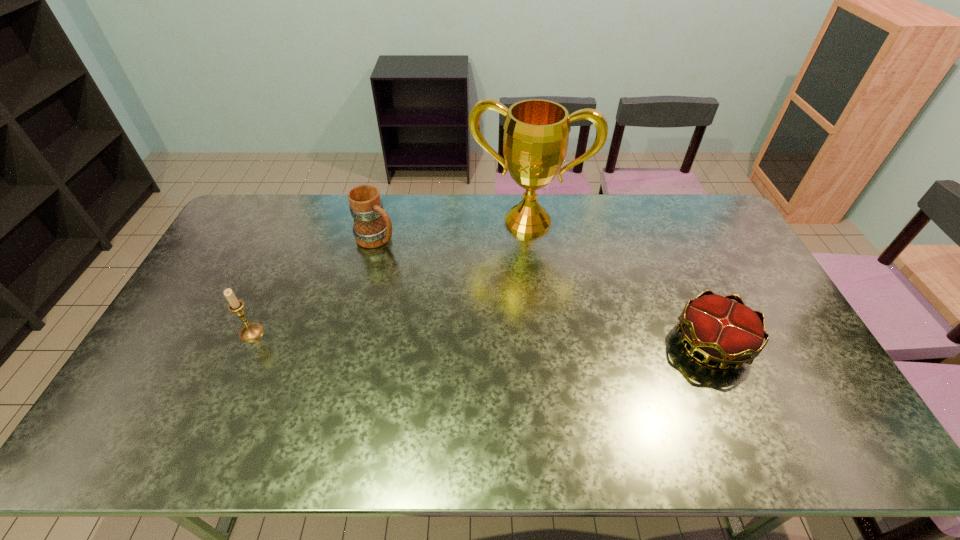
Locate an element on the screen. The image size is (960, 540). free spot located on the side of the mug with the handle is located at coordinates (439, 275).

You are a GUI agent. You are given a task and a screenshot of the screen. Output one action in this format:
    pyautogui.click(x=<x>, y=<y>)
    Task: Click on the vacant space situated 0.150m on the front-facing side of the third object from left to right
    The image size is (960, 540).
    Given the screenshot: What is the action you would take?
    pyautogui.click(x=510, y=269)

This screenshot has width=960, height=540. I want to click on free space located 0.160m on the front-facing side of the third object from left to right, so click(x=509, y=271).

Identify the location of vacant region located 0.130m on the front-facing side of the third object from left to right. The height and width of the screenshot is (540, 960). (511, 265).

The height and width of the screenshot is (540, 960). I want to click on mug at the far edge, so click(x=372, y=228).

Identify the location of award present at the far edge. This screenshot has width=960, height=540. (536, 132).

Locate an element on the screen. object present at the right edge is located at coordinates (730, 333).

In the image, there is a desktop. Where is `free space at the far edge`? free space at the far edge is located at coordinates (637, 222).

In order to click on vacant space at the near edge of the desktop in this screenshot , I will do `click(266, 387)`.

Locate an element on the screen. vacant point at the left edge is located at coordinates (204, 329).